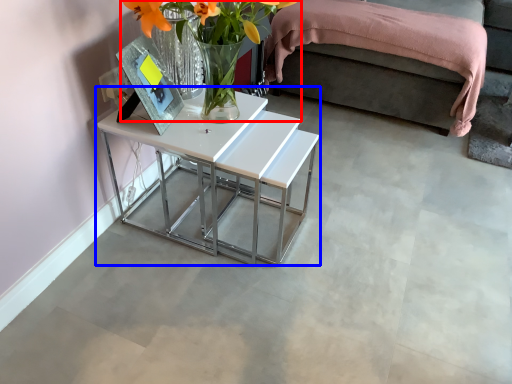
Question: Among these objects, which one is farthest to the camera, floral arrangement (highlighted by a red box) or table (highlighted by a blue box)?

Choices:
 (A) floral arrangement
 (B) table

Answer: (B)